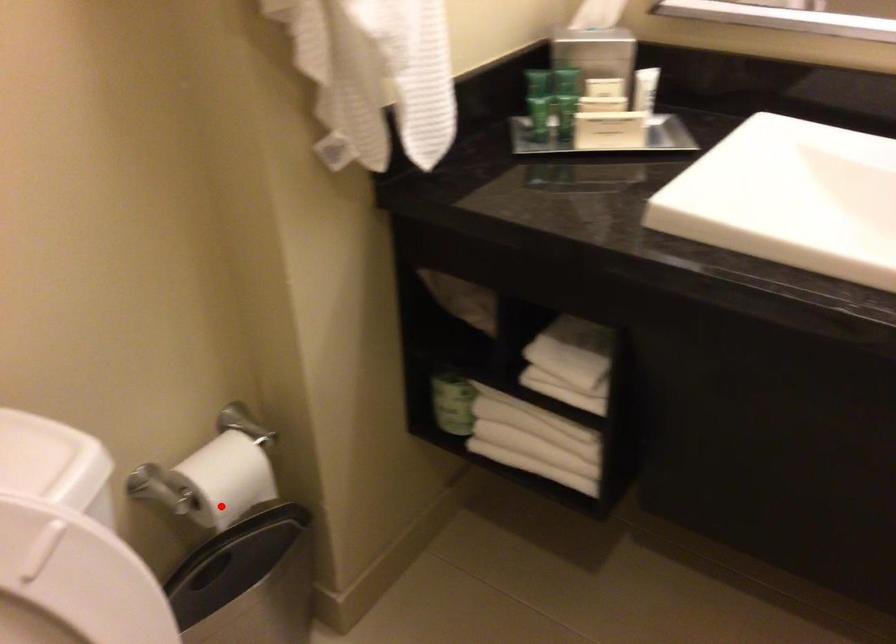
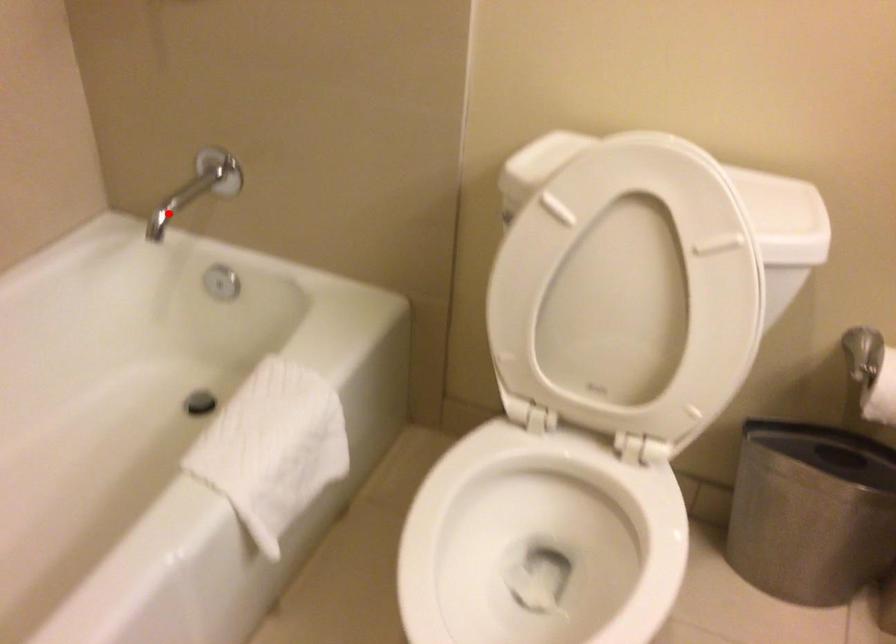
I am providing you with two images of the same scene from different viewpoints. A red point is marked on the first image and another point is marked on the second image. Is the marked point in image1 the same physical position as the marked point in image2?

No